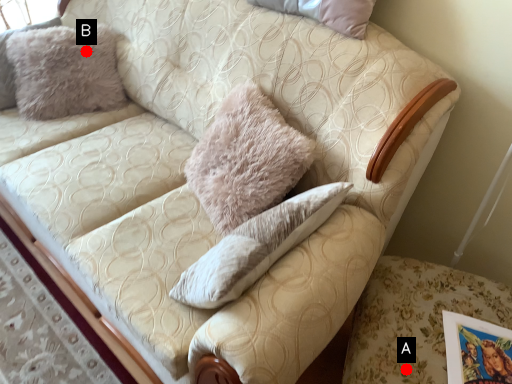
Question: Two points are circled on the image, labeled by A and B beside each circle. Among these points, which one is nearest to the camera?

Choices:
 (A) A is closer
 (B) B is closer

Answer: (A)